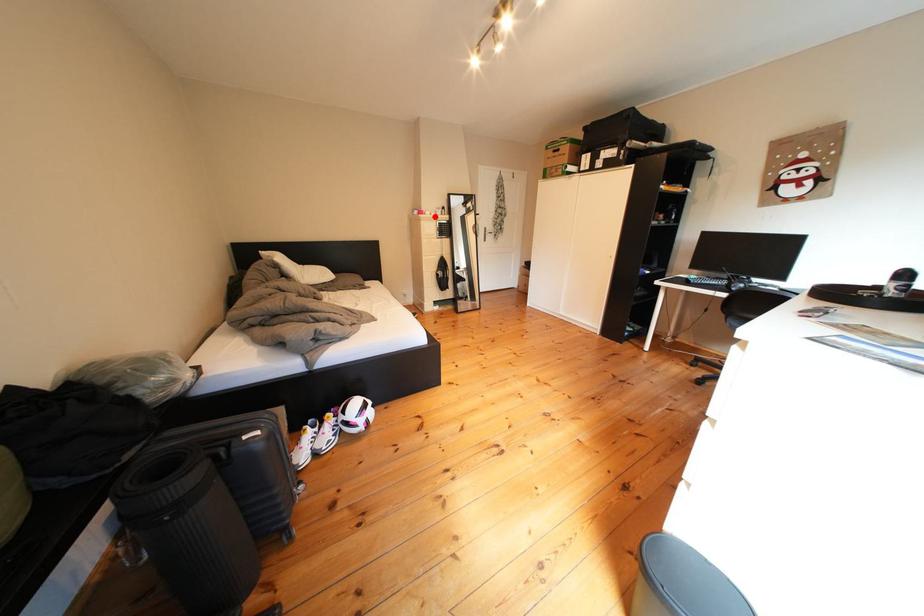
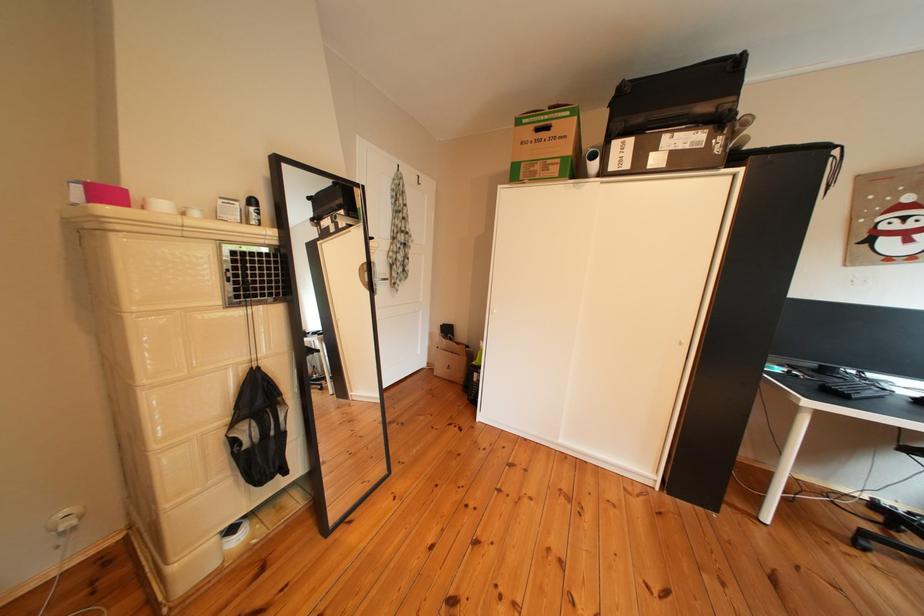
Question: I am providing you with two images of the same scene from different viewpoints. A red point is shown in image1. For the corresponding object point in image2, is it positioned nearer or farther from the camera?

Choices:
 (A) Nearer
 (B) Farther

Answer: (B)